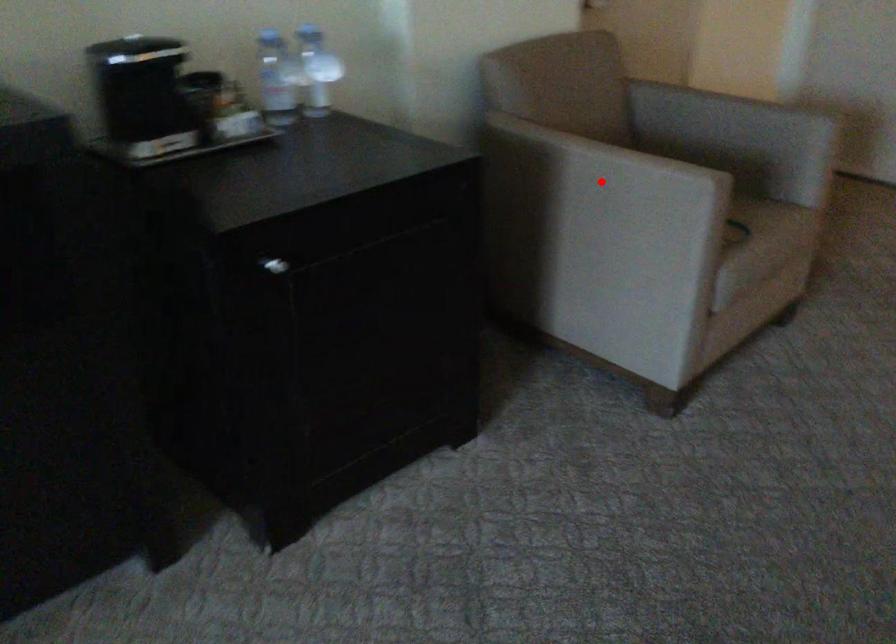
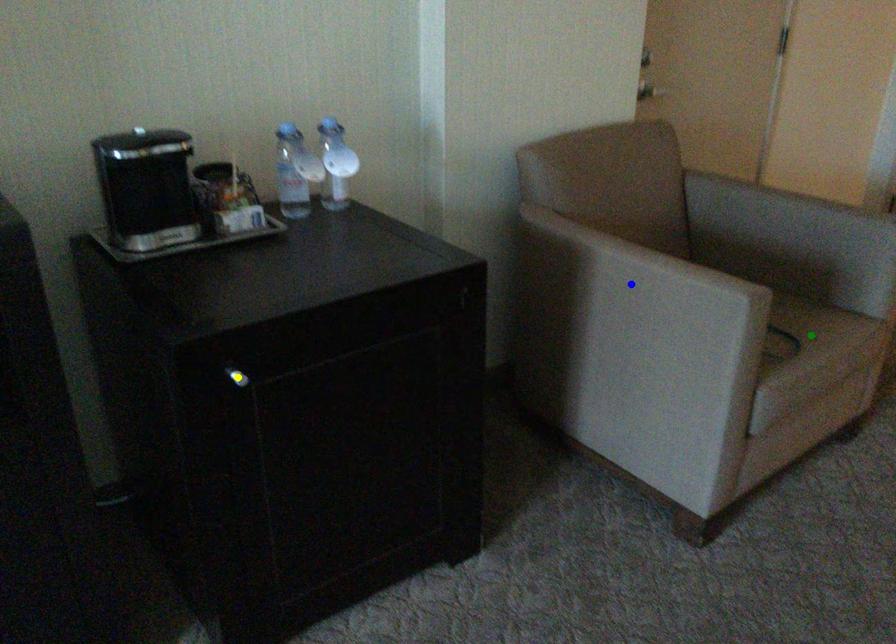
Question: I am providing you with two images of the same scene from different viewpoints. A red point is marked on the first image. You are given multiple points on the second image. Can you choose the point in image 2 that corresponds to the point in image 1?

Choices:
 (A) yellow point
 (B) green point
 (C) blue point

Answer: (C)